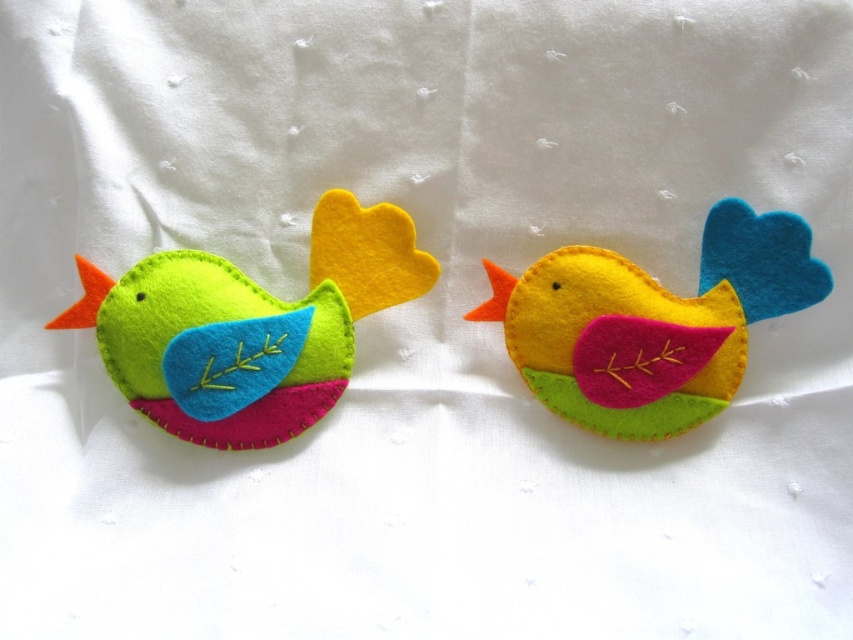
Question: From the image, what is the correct spatial relationship of matte felt bird at left in relation to yellow felt bird at center?

Choices:
 (A) left
 (B) right

Answer: (A)

Question: Which of the following is the closest to the observer?

Choices:
 (A) matte felt bird at left
 (B) yellow felt bird at center

Answer: (B)

Question: Does matte felt bird at left appear on the left side of yellow felt bird at center?

Choices:
 (A) no
 (B) yes

Answer: (B)

Question: Which point is closer to the camera?

Choices:
 (A) (669, 326)
 (B) (374, 236)

Answer: (A)

Question: In this image, where is matte felt bird at left located relative to yellow felt bird at center?

Choices:
 (A) below
 (B) above

Answer: (B)